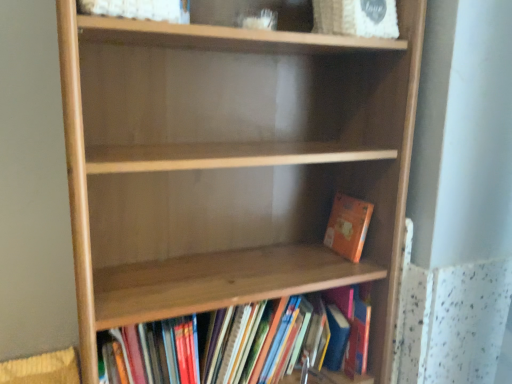
Question: From the image's perspective, is natural wood shelf at center located above or below wooden bookshelf at lower center, which is the first book in bottom-to-top order?

Choices:
 (A) below
 (B) above

Answer: (B)

Question: Is natural wood shelf at center to the left or to the right of wooden bookshelf at lower center, acting as the 2th book starting from the top, in the image?

Choices:
 (A) right
 (B) left

Answer: (B)

Question: Estimate the real-world distances between objects in this image. Which object is farther from the orange matte book at lower right, the first book viewed from the top?

Choices:
 (A) wooden bookshelf at lower center, which is the first book in bottom-to-top order
 (B) natural wood shelf at center

Answer: (B)

Question: Estimate the real-world distances between objects in this image. Which object is closer to the wooden bookshelf at lower center, acting as the 2th book starting from the top?

Choices:
 (A) natural wood shelf at center
 (B) orange matte book at lower right, positioned as the second book in bottom-to-top order

Answer: (A)